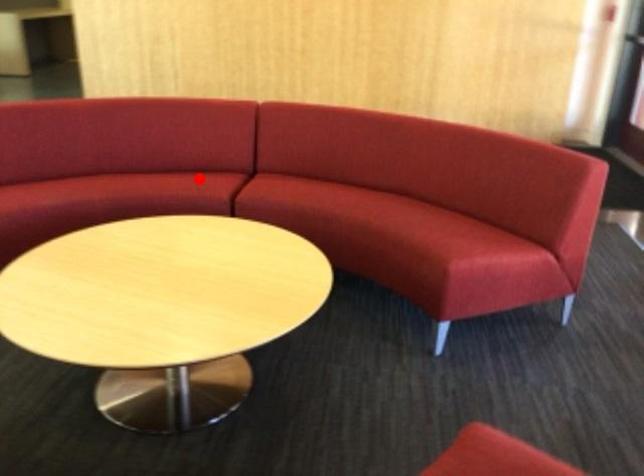
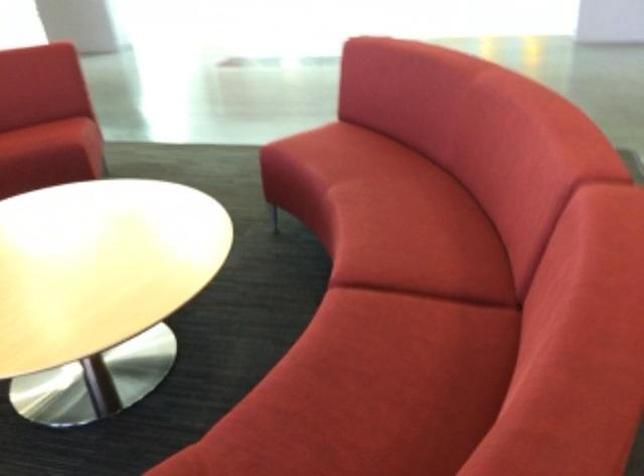
The point at the highlighted location is marked in the first image. Where is the corresponding point in the second image?

(418, 239)